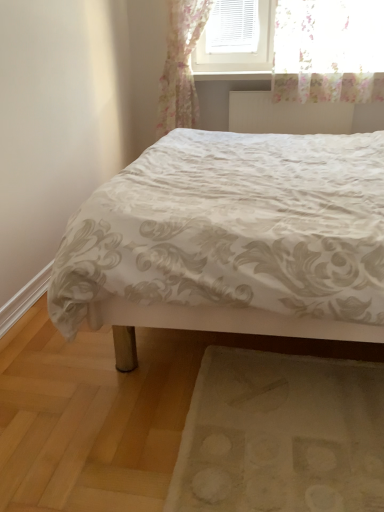
Question: Relative to white textured radiator at upper center, is beige fabric mat at lower right in front or behind?

Choices:
 (A) behind
 (B) front

Answer: (B)

Question: Visually, is beige fabric mat at lower right positioned to the left or to the right of white textured radiator at upper center?

Choices:
 (A) left
 (B) right

Answer: (A)

Question: Which of these objects is positioned farthest from the white satin bed at center?

Choices:
 (A) beige fabric mat at lower right
 (B) white textured radiator at upper center

Answer: (B)

Question: Estimate the real-world distances between objects in this image. Which object is farther from the beige fabric mat at lower right?

Choices:
 (A) white satin bed at center
 (B) white textured radiator at upper center

Answer: (B)